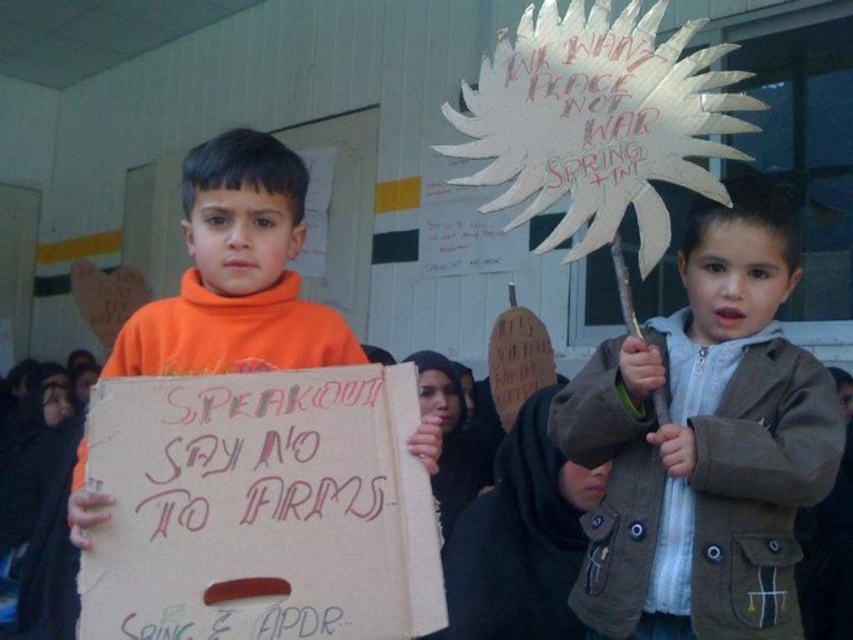
Question: Does brown cotton jacket at center lie in front of orange fleece sweatshirt at center?

Choices:
 (A) yes
 (B) no

Answer: (B)

Question: Which of the following is the farthest from the observer?

Choices:
 (A) (691, 385)
 (B) (218, 216)

Answer: (A)

Question: Is brown cotton jacket at center smaller than orange fleece sweatshirt at center?

Choices:
 (A) no
 (B) yes

Answer: (B)

Question: Does brown cotton jacket at center have a smaller size compared to orange fleece sweatshirt at center?

Choices:
 (A) yes
 (B) no

Answer: (A)

Question: Which point is farther to the camera?

Choices:
 (A) orange fleece sweatshirt at center
 (B) brown cotton jacket at center

Answer: (B)